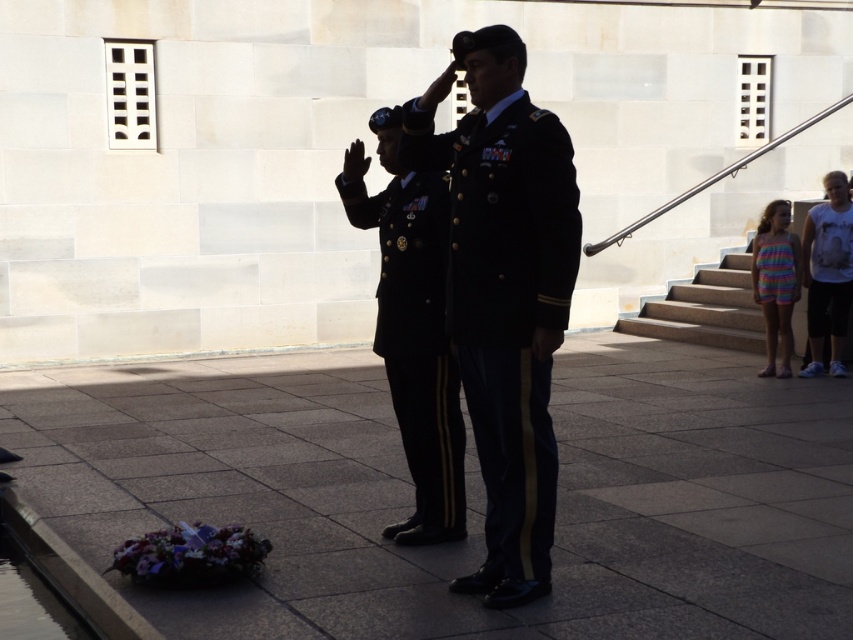
Which of these two, shiny dark blue uniform at center or white cotton t-shirt at right, stands taller?

shiny dark blue uniform at center

Which is behind, point (457, 522) or point (842, 230)?

Point (842, 230)

At what (x,y) coordinates should I click in order to perform the action: click on shiny dark blue uniform at center. Please return your answer as a coordinate pair (x, y). This screenshot has width=853, height=640. Looking at the image, I should click on (416, 340).

Is black uniform at center to the right of white cotton t-shirt at right from the viewer's perspective?

No, black uniform at center is not to the right of white cotton t-shirt at right.

In the scene shown: Is the position of black uniform at center less distant than that of white cotton t-shirt at right?

That is True.

You are a GUI agent. You are given a task and a screenshot of the screen. Output one action in this format:
    pyautogui.click(x=<x>, y=<y>)
    Task: Click on the black uniform at center
    The height and width of the screenshot is (640, 853).
    Given the screenshot: What is the action you would take?
    click(503, 292)

Is black uniform at center further to the viewer compared to shiny dark blue uniform at center?

No, black uniform at center is closer to the viewer.

Which is below, black uniform at center or shiny dark blue uniform at center?

shiny dark blue uniform at center is below.

Where is `black uniform at center`? black uniform at center is located at coordinates (503, 292).